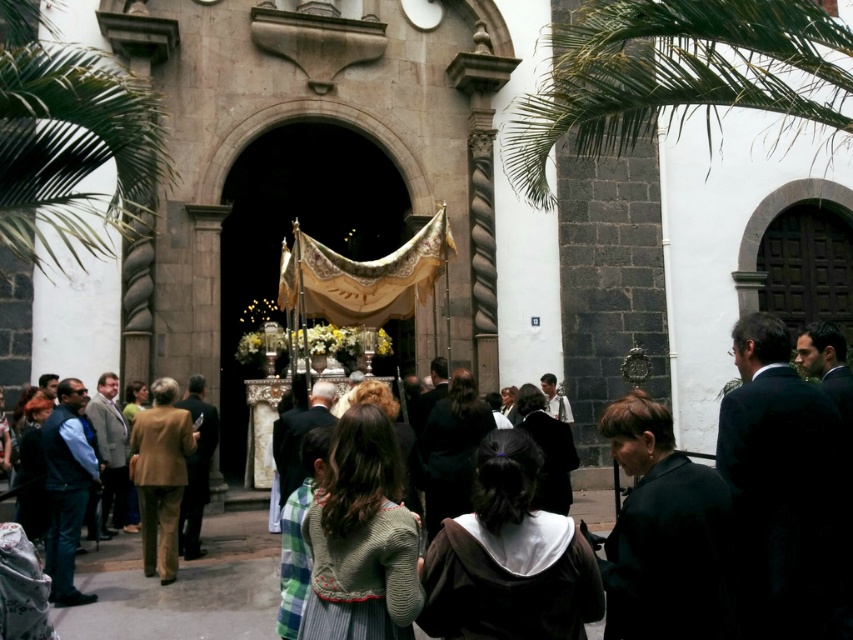
You are standing at the entrance of the church and notice the green leafy palm tree at upper right and the dark brown hoodie at center. Which object appears larger in the scene?

The green leafy palm tree at upper right appears larger than the dark brown hoodie at center.

You are standing at the center of the scene facing the church. Where is the green leafy palm tree at left located relative to your position?

The green leafy palm tree at left is located to the left side of your position, at coordinates approximately 0.216 on the x and 0.082 on the y axis.

You are standing in front of the church altar and notice a point marked at coordinates (680, 76). What object is located at this point?

The point at coordinates (680, 76) corresponds to the green leafy palm tree at upper right.